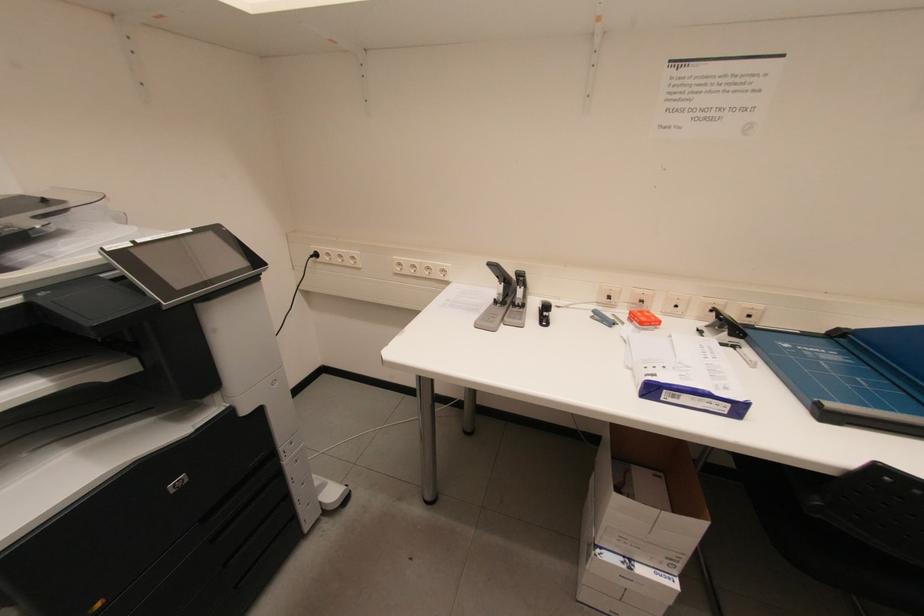
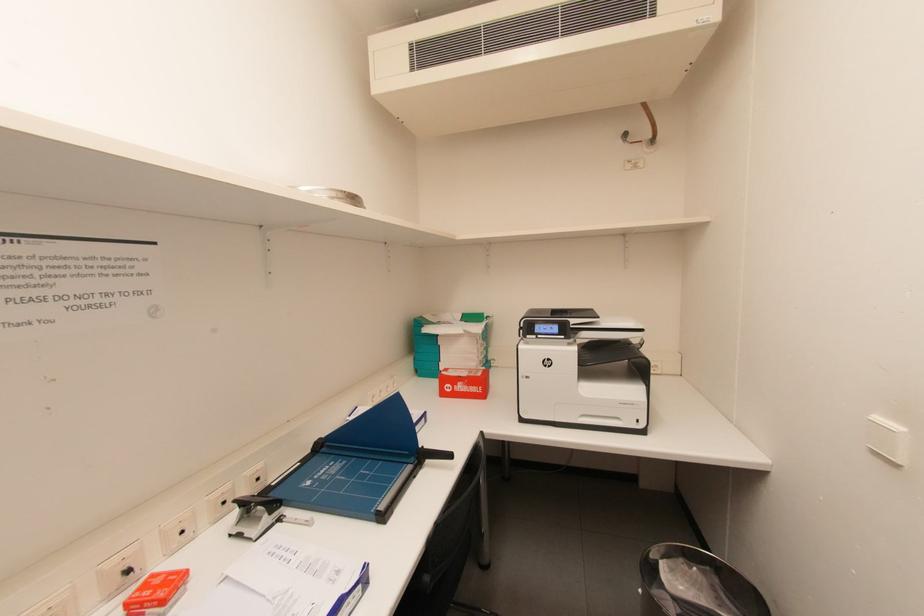
Question: The first image is from the beginning of the video and the second image is from the end. How did the camera likely rotate when shooting the video?

Choices:
 (A) Left
 (B) Right
 (C) Up
 (D) Down

Answer: (B)